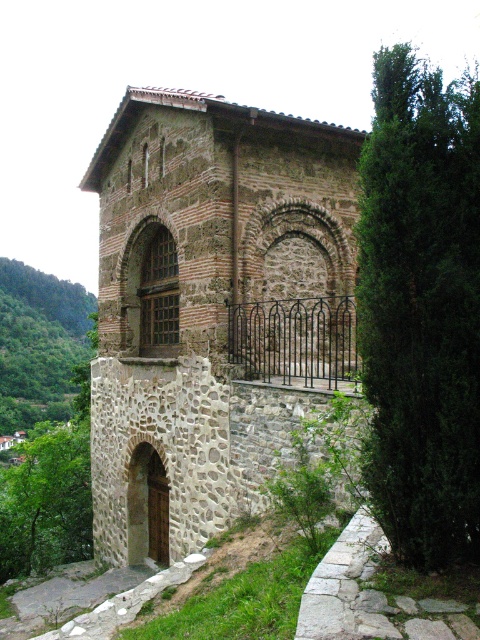
Who is positioned more to the left, stone textured archway at center or brown stone archway at lower left?

From the viewer's perspective, brown stone archway at lower left appears more on the left side.

Is stone textured archway at center closer to camera compared to brown stone archway at lower left?

Yes.

Locate an element on the screen. stone textured archway at center is located at coordinates (297, 301).

You are a GUI agent. You are given a task and a screenshot of the screen. Output one action in this format:
    pyautogui.click(x=<x>, y=<y>)
    Task: Click on the stone textured archway at center
    
    Given the screenshot: What is the action you would take?
    pyautogui.click(x=297, y=301)